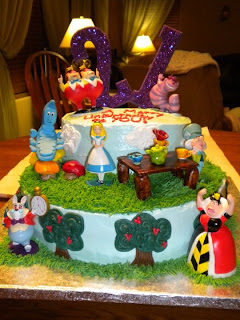
This screenshot has height=320, width=240. Identify the location of cup. (182, 152).